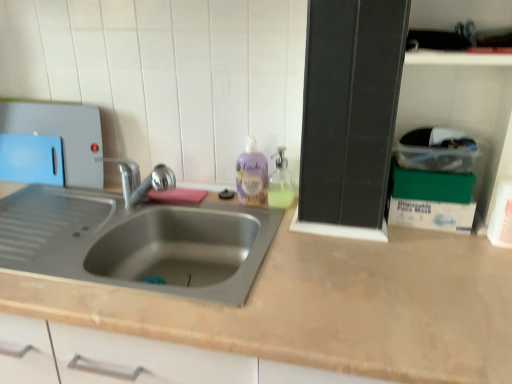
At what (x,y) coordinates should I click in order to perform the action: click on green cardboard box at upper right, which is the 2th box in top-to-bottom order. Please return your answer as a coordinate pair (x, y). The height and width of the screenshot is (384, 512). Looking at the image, I should click on (430, 185).

Identify the location of pink sponge at sink. The image size is (512, 384). (178, 195).

You are a GUI agent. You are given a task and a screenshot of the screen. Output one action in this format:
    pyautogui.click(x=<x>, y=<y>)
    Task: Click on the green cardboard box at right, which appears as the third box when viewed from the top
    The width and height of the screenshot is (512, 384).
    Given the screenshot: What is the action you would take?
    pyautogui.click(x=431, y=215)

The width and height of the screenshot is (512, 384). In order to click on clear plastic container at upper right, which appears as the third box when ordered from the bottom in this screenshot , I will do `click(436, 150)`.

Locate an element on the screen. The width and height of the screenshot is (512, 384). translucent plastic soap dispenser at upper right is located at coordinates click(281, 182).

From the image's perspective, which one is positioned higher, pink sponge at sink or purple translucent liquid soap at center?

purple translucent liquid soap at center, from the image's perspective.

Is point (173, 192) farther from viewer compared to point (263, 203)?

Yes.

Between purple translucent liquid soap at center and pink sponge at sink, which one is positioned behind?

pink sponge at sink is more distant.

Is purple translucent liquid soap at center oriented towards pink sponge at sink?

No, purple translucent liquid soap at center is not oriented towards pink sponge at sink.

From the image's perspective, would you say purple translucent liquid soap at center is positioned over pink sponge at sink?

Yes.

From a real-world perspective, is purple translucent liquid soap at center on pink sponge at sink?

Yes, from a real-world perspective, purple translucent liquid soap at center is above pink sponge at sink.

From the image's perspective, which is above, translucent plastic soap dispenser at upper right or green cardboard box at upper right, which is the 2th box in bottom-to-top order?

translucent plastic soap dispenser at upper right.

Is translucent plastic soap dispenser at upper right positioned far away from green cardboard box at upper right, which is the 2th box in top-to-bottom order?

No, translucent plastic soap dispenser at upper right is not far from green cardboard box at upper right, which is the 2th box in top-to-bottom order.

The height and width of the screenshot is (384, 512). Find the location of `the 1st box to the right of the translucent plastic soap dispenser at upper right, starting your count from the anchor`. the 1st box to the right of the translucent plastic soap dispenser at upper right, starting your count from the anchor is located at coordinates (430, 185).

Is translucent plastic soap dispenser at upper right to the left of green cardboard box at upper right, which is the 2th box in bottom-to-top order, from the viewer's perspective?

Correct, you'll find translucent plastic soap dispenser at upper right to the left of green cardboard box at upper right, which is the 2th box in bottom-to-top order.

Between translucent plastic soap dispenser at upper right and green cardboard box at right, which appears as the third box when viewed from the top, which one appears on the right side from the viewer's perspective?

From the viewer's perspective, green cardboard box at right, which appears as the third box when viewed from the top, appears more on the right side.

Looking at their sizes, would you say translucent plastic soap dispenser at upper right is wider or thinner than green cardboard box at right, which appears as the third box when viewed from the top?

In the image, translucent plastic soap dispenser at upper right appears to be wider than green cardboard box at right, which appears as the third box when viewed from the top.

Considering the positions of points (271, 189) and (410, 205), is point (271, 189) farther from camera compared to point (410, 205)?

Yes, it is.

Does green cardboard box at right, which appears as the 1th box when ordered from the bottom, have a lesser width compared to pink sponge at sink?

Yes, green cardboard box at right, which appears as the 1th box when ordered from the bottom, is thinner than pink sponge at sink.

Considering the sizes of green cardboard box at right, which appears as the third box when viewed from the top, and pink sponge at sink in the image, is green cardboard box at right, which appears as the third box when viewed from the top, bigger or smaller than pink sponge at sink?

Considering their sizes, green cardboard box at right, which appears as the third box when viewed from the top, takes up more space than pink sponge at sink.

From a real-world perspective, is green cardboard box at right, which appears as the third box when viewed from the top, located beneath pink sponge at sink?

No, from a real-world perspective, green cardboard box at right, which appears as the third box when viewed from the top, is not beneath pink sponge at sink.

Are green cardboard box at right, which appears as the 1th box when ordered from the bottom, and pink sponge at sink located far from each other?

green cardboard box at right, which appears as the 1th box when ordered from the bottom, is actually quite close to pink sponge at sink.

Which point is more distant from viewer, (80, 168) or (290, 184)?

Point (80, 168)

How many degrees apart are the facing directions of blue plastic cutting board at left and translucent plastic soap dispenser at upper right?

There is a 0.125-degree angle between the facing directions of blue plastic cutting board at left and translucent plastic soap dispenser at upper right.

The width and height of the screenshot is (512, 384). In order to click on appliance above the translucent plastic soap dispenser at upper right (from a real-world perspective) in this screenshot , I will do `click(61, 134)`.

Is blue plastic cutting board at left taller than translucent plastic soap dispenser at upper right?

Yes.

Considering the sizes of objects translucent plastic soap dispenser at upper right and pink sponge at sink in the image provided, who is bigger, translucent plastic soap dispenser at upper right or pink sponge at sink?

translucent plastic soap dispenser at upper right.

How many degrees apart are the facing directions of translucent plastic soap dispenser at upper right and pink sponge at sink?

The angle between the facing direction of translucent plastic soap dispenser at upper right and the facing direction of pink sponge at sink is 0.00111 degrees.

Between translucent plastic soap dispenser at upper right and pink sponge at sink, which one appears on the right side from the viewer's perspective?

Positioned to the right is translucent plastic soap dispenser at upper right.

Which is behind, point (290, 198) or point (181, 195)?

Point (181, 195)

The image size is (512, 384). In order to click on soap below the purple translucent liquid soap at center (from a real-world perspective) in this screenshot , I will do `click(178, 195)`.

You are a GUI agent. You are given a task and a screenshot of the screen. Output one action in this format:
    pyautogui.click(x=<x>, y=<y>)
    Task: Click on the soap behind the purple translucent liquid soap at center
    This screenshot has height=384, width=512.
    Given the screenshot: What is the action you would take?
    pyautogui.click(x=178, y=195)

Looking at the image, which one is located closer to clear plastic container at upper right, which appears as the third box when ordered from the bottom, green cardboard box at upper right, which is the 2th box in top-to-bottom order, or translucent plastic soap dispenser at upper right?

green cardboard box at upper right, which is the 2th box in top-to-bottom order, is positioned closer to the anchor clear plastic container at upper right, which appears as the third box when ordered from the bottom.

Considering their positions, is pink sponge at sink positioned closer to green cardboard box at upper right, which is the 2th box in top-to-bottom order, than translucent plastic soap dispenser at upper right?

translucent plastic soap dispenser at upper right is positioned closer to the anchor green cardboard box at upper right, which is the 2th box in top-to-bottom order.

Which object lies nearer to the anchor point clear plastic container at upper right, which appears as the third box when ordered from the bottom, purple translucent liquid soap at center or green cardboard box at upper right, which is the 2th box in top-to-bottom order?

Among the two, green cardboard box at upper right, which is the 2th box in top-to-bottom order, is located nearer to clear plastic container at upper right, which appears as the third box when ordered from the bottom.

When comparing their distances from green cardboard box at upper right, which is the 2th box in bottom-to-top order, does blue plastic cutting board at left or translucent plastic soap dispenser at upper right seem further?

blue plastic cutting board at left lies further to green cardboard box at upper right, which is the 2th box in bottom-to-top order, than the other object.

Considering their positions, is blue plastic cutting board at left positioned further to pink sponge at sink than clear plastic container at upper right, which is the 1th box from top to bottom?

clear plastic container at upper right, which is the 1th box from top to bottom, is further to pink sponge at sink.

Based on the photo, estimate the real-world distances between objects in this image. Which object is further from clear plastic container at upper right, which is the 1th box from top to bottom, blue plastic cutting board at left or pink sponge at sink?

blue plastic cutting board at left is positioned further to the anchor clear plastic container at upper right, which is the 1th box from top to bottom.

Which object lies nearer to the anchor point purple translucent liquid soap at center, blue plastic cutting board at left or green cardboard box at right, which appears as the third box when viewed from the top?

green cardboard box at right, which appears as the third box when viewed from the top.

In the scene shown: When comparing their distances from green cardboard box at right, which appears as the 1th box when ordered from the bottom, does pink sponge at sink or blue plastic cutting board at left seem further?

Based on the image, blue plastic cutting board at left appears to be further to green cardboard box at right, which appears as the 1th box when ordered from the bottom.

Locate an element on the screen. The height and width of the screenshot is (384, 512). soap dispenser between purple translucent liquid soap at center and green cardboard box at upper right, which is the 2th box in bottom-to-top order, from left to right is located at coordinates (281, 182).

Image resolution: width=512 pixels, height=384 pixels. In order to click on soap dispenser between purple translucent liquid soap at center and green cardboard box at right, which appears as the 1th box when ordered from the bottom, from left to right in this screenshot , I will do `click(281, 182)`.

This screenshot has width=512, height=384. I want to click on cleaning product between blue plastic cutting board at left and green cardboard box at right, which appears as the third box when viewed from the top, in the horizontal direction, so 252,175.

Identify the location of soap between blue plastic cutting board at left and purple translucent liquid soap at center from left to right. The image size is (512, 384). (178, 195).